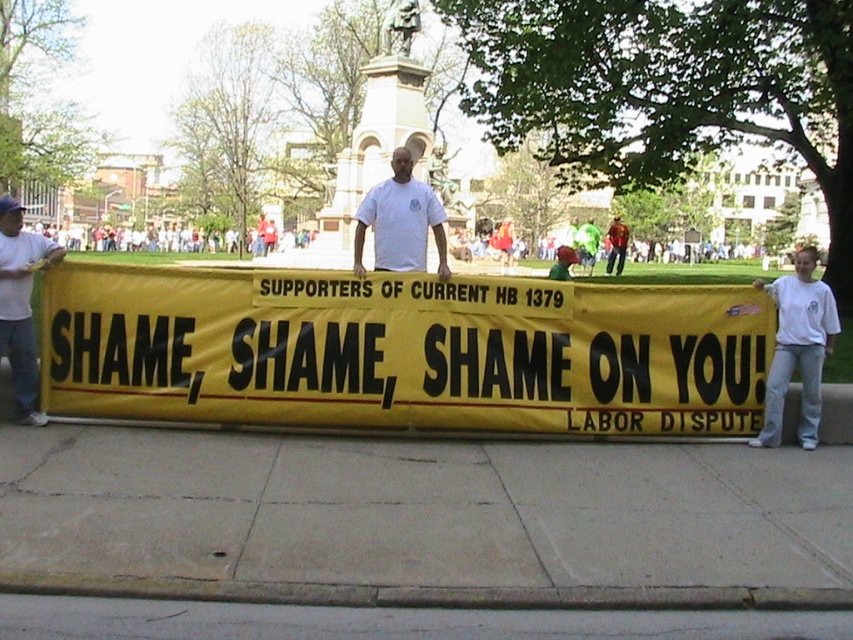
How far apart are yellow/yellow fabric banner at center and white t-shirt at center?

yellow/yellow fabric banner at center and white t-shirt at center are 1.60 meters apart from each other.

Who is higher up, yellow/yellow fabric banner at center or white t-shirt at center?

Positioned higher is white t-shirt at center.

Image resolution: width=853 pixels, height=640 pixels. What do you see at coordinates (402, 349) in the screenshot?
I see `yellow/yellow fabric banner at center` at bounding box center [402, 349].

The height and width of the screenshot is (640, 853). I want to click on yellow/yellow fabric banner at center, so click(x=402, y=349).

Between gray concrete pavement at lower center and white t-shirt at center, which one is positioned lower?

gray concrete pavement at lower center

How distant is gray concrete pavement at lower center from white t-shirt at center?

gray concrete pavement at lower center and white t-shirt at center are 3.96 meters apart from each other.

Based on the photo, who is more forward, (631, 637) or (370, 209)?

Positioned in front is point (631, 637).

Image resolution: width=853 pixels, height=640 pixels. I want to click on gray concrete pavement at lower center, so click(392, 621).

Does white cotton shirt at right lie in front of white t-shirt at center?

Yes, it is.

Measure the distance between point [809,339] and camera.

Point [809,339] and camera are 7.45 meters apart.

This screenshot has width=853, height=640. I want to click on white cotton shirt at right, so click(798, 348).